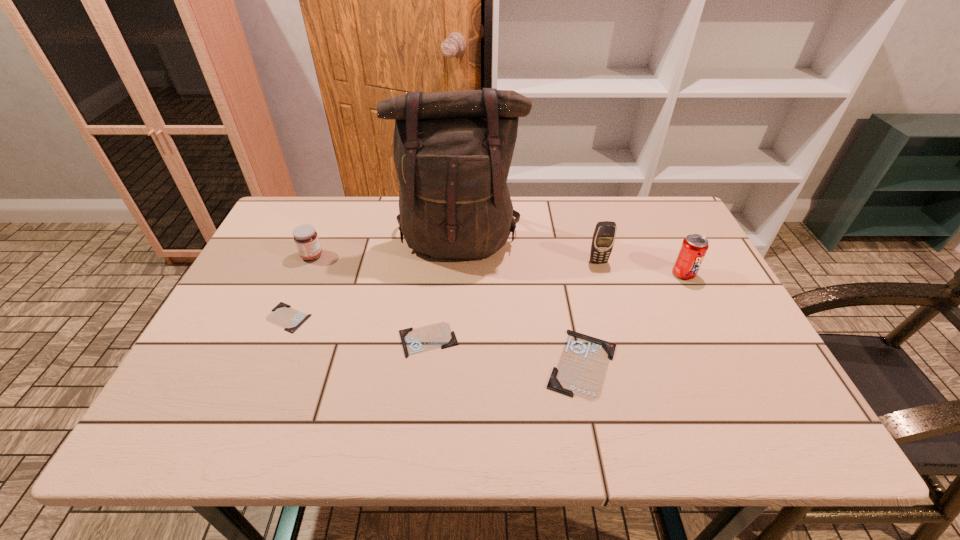
I want to click on cellular telephone, so click(603, 239).

Where is `vacant space located on the back of the shortest object`? vacant space located on the back of the shortest object is located at coordinates (309, 269).

Where is `vacant space located on the left of the second shortest identity card`? The image size is (960, 540). vacant space located on the left of the second shortest identity card is located at coordinates (246, 340).

Locate an element on the screen. The width and height of the screenshot is (960, 540). vacant space located on the back of the rightmost identity card is located at coordinates tap(572, 315).

Find the location of `free space located 0.170m on the open flap of the tallest object`. free space located 0.170m on the open flap of the tallest object is located at coordinates (454, 317).

Locate an element on the screen. The width and height of the screenshot is (960, 540). vacant space located 0.070m on the back of the fifth shortest object is located at coordinates (672, 251).

Identify the location of vacant space located 0.150m on the back of the fourth shortest object. The image size is (960, 540). (328, 219).

The image size is (960, 540). I want to click on free space located 0.130m on the front face of the cellular telephone, so click(x=609, y=298).

Locate an element on the screen. This screenshot has width=960, height=540. object that is at the far edge is located at coordinates (453, 149).

Where is `object that is at the near edge`? The width and height of the screenshot is (960, 540). object that is at the near edge is located at coordinates (581, 370).